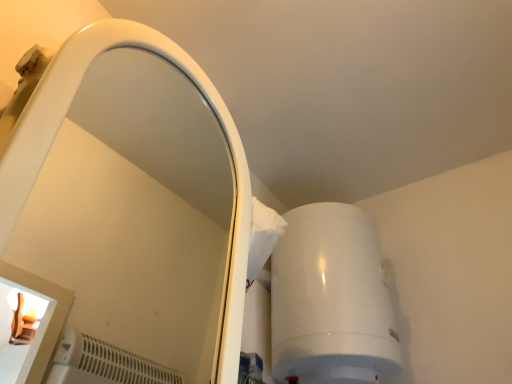
Question: Is white glossy mirror at upper left in front of or behind white glossy water heater at upper right in the image?

Choices:
 (A) behind
 (B) front

Answer: (B)

Question: Based on their sizes in the image, would you say white glossy mirror at upper left is bigger or smaller than white glossy water heater at upper right?

Choices:
 (A) big
 (B) small

Answer: (B)

Question: From a real-world perspective, is white glossy mirror at upper left above or below white glossy water heater at upper right?

Choices:
 (A) above
 (B) below

Answer: (B)

Question: Is white glossy water heater at upper right spatially inside white glossy mirror at upper left, or outside of it?

Choices:
 (A) inside
 (B) outside

Answer: (B)

Question: In terms of size, does white glossy water heater at upper right appear bigger or smaller than white glossy mirror at upper left?

Choices:
 (A) big
 (B) small

Answer: (A)

Question: Is white glossy water heater at upper right taller or shorter than white glossy mirror at upper left?

Choices:
 (A) short
 (B) tall

Answer: (A)

Question: Visually, is white glossy water heater at upper right positioned to the left or to the right of white glossy mirror at upper left?

Choices:
 (A) left
 (B) right

Answer: (B)